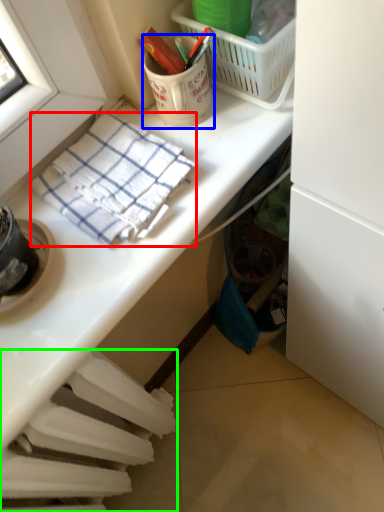
Question: Based on their relative distances, which object is farther from towel/napkin (highlighted by a red box)? Choose from coffee cup (highlighted by a blue box) and radiator (highlighted by a green box).

Choices:
 (A) coffee cup
 (B) radiator

Answer: (B)